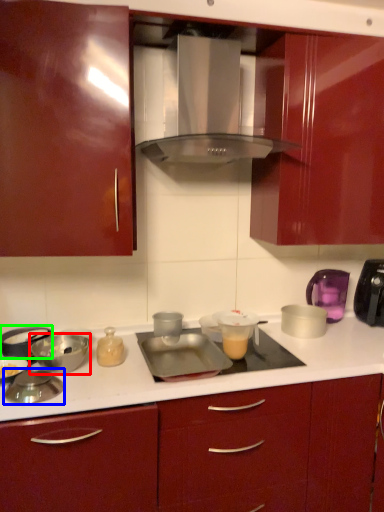
Question: Which object is positioned farthest from bowl (highlighted by a red box)? Select from appliance (highlighted by a blue box) and appliance (highlighted by a green box).

Choices:
 (A) appliance
 (B) appliance

Answer: (A)